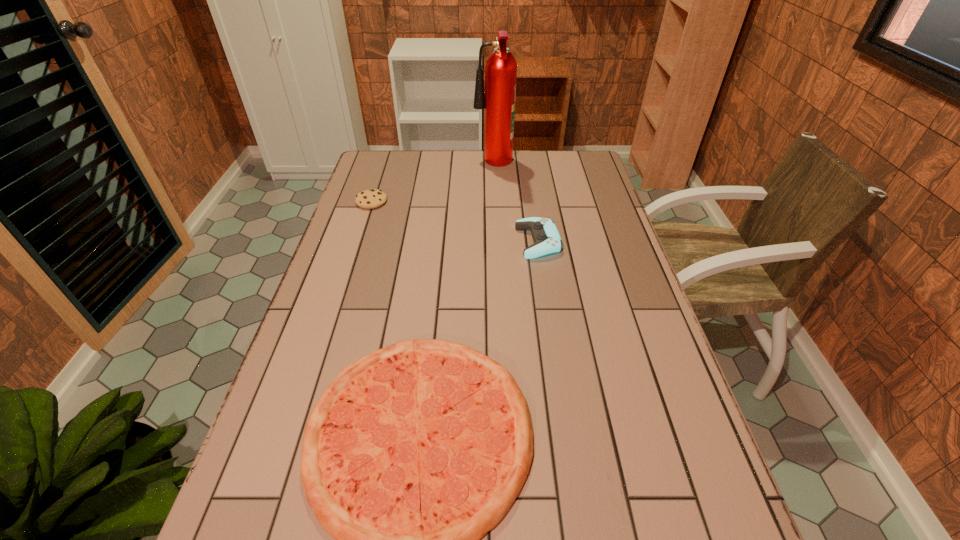
Where is `object that is at the far edge`? object that is at the far edge is located at coordinates [498, 98].

Identify the location of object located at the left edge. (372, 198).

Where is `vacant area at the far edge of the desktop`? This screenshot has width=960, height=540. vacant area at the far edge of the desktop is located at coordinates (415, 166).

The width and height of the screenshot is (960, 540). I want to click on free space at the left edge of the desktop, so pyautogui.click(x=304, y=380).

This screenshot has width=960, height=540. Identify the location of vacant space at the right edge of the desktop. (587, 184).

In the image, there is a desktop. Where is `vacant space at the far left corner`? This screenshot has height=540, width=960. vacant space at the far left corner is located at coordinates (395, 156).

You are a GUI agent. You are given a task and a screenshot of the screen. Output one action in this format:
    pyautogui.click(x=<x>, y=<y>)
    Task: Click on the vacant point located between the second nearest object and the second farthest object
    Image resolution: width=960 pixels, height=540 pixels.
    Given the screenshot: What is the action you would take?
    pyautogui.click(x=455, y=221)

Where is `free spot between the second tallest object and the tallest object`? The width and height of the screenshot is (960, 540). free spot between the second tallest object and the tallest object is located at coordinates (516, 203).

Image resolution: width=960 pixels, height=540 pixels. Identify the location of free spot between the cookie and the control. (455, 221).

Where is `object that is the second closest one to the pizza`? This screenshot has height=540, width=960. object that is the second closest one to the pizza is located at coordinates (372, 198).